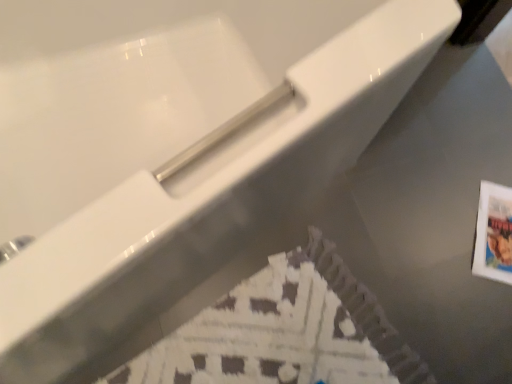
Image resolution: width=512 pixels, height=384 pixels. I want to click on free spot behind printed paper postcard at lower right, so click(x=476, y=163).